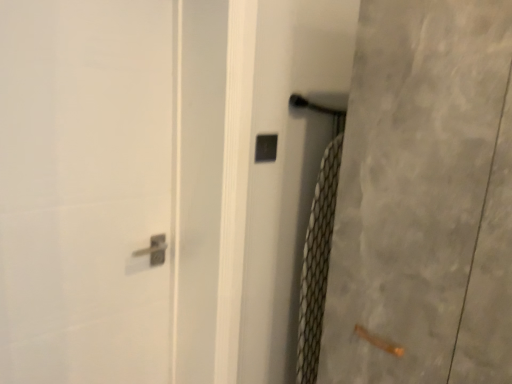
Question: Considering the relative sizes of white glossy door handle at upper center, arranged as the first screen door when viewed from the left, and clear plastic screen door at center, the 2th screen door when ordered from left to right, in the image provided, is white glossy door handle at upper center, arranged as the first screen door when viewed from the left, taller than clear plastic screen door at center, the 2th screen door when ordered from left to right,?

Choices:
 (A) no
 (B) yes

Answer: (B)

Question: Does white glossy door handle at upper center, arranged as the first screen door when viewed from the left, come behind clear plastic screen door at center, the 2th screen door from the right?

Choices:
 (A) yes
 (B) no

Answer: (B)

Question: Can you confirm if white glossy door handle at upper center, which is counted as the third screen door, starting from the right, is positioned to the left of clear plastic screen door at center, the 2th screen door from the right?

Choices:
 (A) no
 (B) yes

Answer: (B)

Question: Is white glossy door handle at upper center, arranged as the first screen door when viewed from the left, far away from clear plastic screen door at center, the 2th screen door from the right?

Choices:
 (A) no
 (B) yes

Answer: (A)

Question: From the image's perspective, would you say white glossy door handle at upper center, which is counted as the third screen door, starting from the right, is shown under clear plastic screen door at center, the 2th screen door from the right?

Choices:
 (A) yes
 (B) no

Answer: (B)

Question: From a real-world perspective, is black plastic lock at center above or below clear plastic screen door at center, the 2th screen door from the right?

Choices:
 (A) above
 (B) below

Answer: (A)

Question: In terms of size, does black plastic lock at center appear bigger or smaller than clear plastic screen door at center, the 2th screen door when ordered from left to right?

Choices:
 (A) small
 (B) big

Answer: (A)

Question: From the image's perspective, relative to clear plastic screen door at center, the 2th screen door from the right, is black plastic lock at center above or below?

Choices:
 (A) below
 (B) above

Answer: (B)

Question: From their relative heights in the image, would you say black plastic lock at center is taller or shorter than clear plastic screen door at center, the 2th screen door when ordered from left to right?

Choices:
 (A) short
 (B) tall

Answer: (A)

Question: Looking at their shapes, would you say white glossy door handle at upper center, which is counted as the third screen door, starting from the right, is wider or thinner than white textured screen door at right, acting as the 3th screen door starting from the left?

Choices:
 (A) wide
 (B) thin

Answer: (B)

Question: Is point (97, 170) positioned closer to the camera than point (400, 137)?

Choices:
 (A) farther
 (B) closer

Answer: (A)

Question: From a real-world perspective, is white glossy door handle at upper center, arranged as the first screen door when viewed from the left, positioned above or below white textured screen door at right, the first screen door when ordered from right to left?

Choices:
 (A) above
 (B) below

Answer: (B)

Question: Is white glossy door handle at upper center, arranged as the first screen door when viewed from the left, taller or shorter than white textured screen door at right, the first screen door when ordered from right to left?

Choices:
 (A) short
 (B) tall

Answer: (B)

Question: Is point (358, 44) positioned closer to the camera than point (111, 51)?

Choices:
 (A) farther
 (B) closer

Answer: (B)

Question: In terms of width, does white textured screen door at right, acting as the 3th screen door starting from the left, look wider or thinner when compared to white glossy door handle at upper center, arranged as the first screen door when viewed from the left?

Choices:
 (A) wide
 (B) thin

Answer: (A)